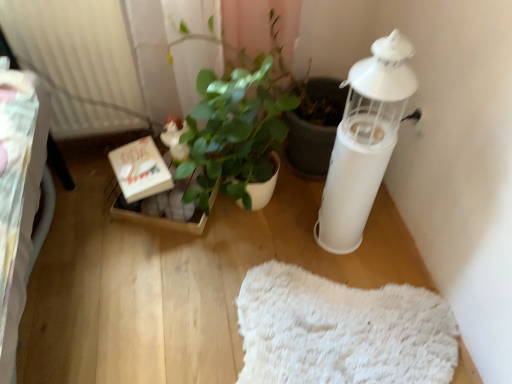
Question: From a real-world perspective, is white ribbed radiator at upper left beneath white matte candle holder at right?

Choices:
 (A) no
 (B) yes

Answer: (A)

Question: Considering the relative sizes of white ribbed radiator at upper left and white matte candle holder at right in the image provided, is white ribbed radiator at upper left smaller than white matte candle holder at right?

Choices:
 (A) no
 (B) yes

Answer: (A)

Question: Is white ribbed radiator at upper left facing towards white matte candle holder at right?

Choices:
 (A) yes
 (B) no

Answer: (B)

Question: From the image's perspective, is white ribbed radiator at upper left under white matte candle holder at right?

Choices:
 (A) no
 (B) yes

Answer: (A)

Question: Considering the relative positions of white ribbed radiator at upper left and white matte candle holder at right in the image provided, is white ribbed radiator at upper left in front of white matte candle holder at right?

Choices:
 (A) yes
 (B) no

Answer: (B)

Question: Considering the relative positions of white ribbed radiator at upper left and white matte candle holder at right in the image provided, is white ribbed radiator at upper left to the right of white matte candle holder at right from the viewer's perspective?

Choices:
 (A) yes
 (B) no

Answer: (B)

Question: Can you confirm if white fluffy mat at lower center is smaller than green glossy plant at center?

Choices:
 (A) yes
 (B) no

Answer: (A)

Question: Is the depth of white fluffy mat at lower center less than that of green glossy plant at center?

Choices:
 (A) yes
 (B) no

Answer: (B)

Question: From the image's perspective, is white fluffy mat at lower center beneath green glossy plant at center?

Choices:
 (A) no
 (B) yes

Answer: (B)

Question: Does white fluffy mat at lower center have a greater width compared to green glossy plant at center?

Choices:
 (A) no
 (B) yes

Answer: (B)

Question: Considering the relative sizes of white fluffy mat at lower center and green glossy plant at center in the image provided, is white fluffy mat at lower center bigger than green glossy plant at center?

Choices:
 (A) no
 (B) yes

Answer: (A)

Question: Can you confirm if white fluffy mat at lower center is thinner than green glossy plant at center?

Choices:
 (A) yes
 (B) no

Answer: (B)

Question: From the image's perspective, is white fluffy mat at lower center on white matte candle holder at right?

Choices:
 (A) yes
 (B) no

Answer: (B)